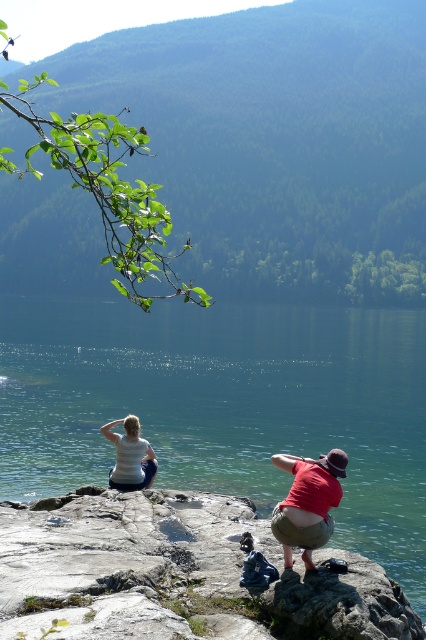
Question: From the image, what is the correct spatial relationship of green stone lake at center in relation to rough textured rock at center?

Choices:
 (A) below
 (B) above

Answer: (B)

Question: Observing the image, what is the correct spatial positioning of green stone lake at center in reference to white cotton shirt at center?

Choices:
 (A) left
 (B) right

Answer: (A)

Question: Is rough textured rock at center smaller than white cotton shirt at center?

Choices:
 (A) yes
 (B) no

Answer: (A)

Question: Among these objects, which one is farthest from the camera?

Choices:
 (A) green stone lake at center
 (B) white cotton shirt at center
 (C) red cotton shirt at center

Answer: (A)

Question: Which is nearer to the white matte shirt at center?

Choices:
 (A) red cotton shirt at center
 (B) white cotton shirt at center
 (C) rough textured rock at center
 (D) green stone lake at center

Answer: (B)

Question: Which object appears closest to the camera in this image?

Choices:
 (A) white matte shirt at center
 (B) white cotton shirt at center

Answer: (B)